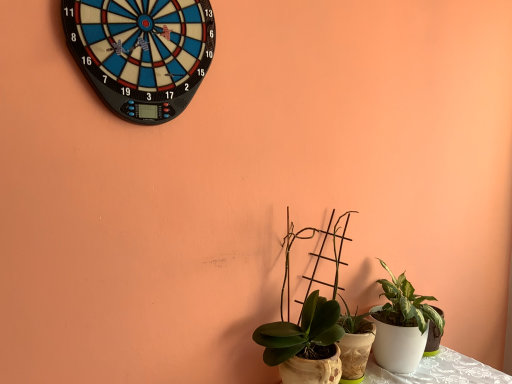
Question: Is green matte plant at center, the 1th houseplant from the left, not within white glossy pot at lower right, which appears as the 1th houseplant when viewed from the right?

Choices:
 (A) yes
 (B) no

Answer: (A)

Question: Is green matte plant at center, the 1th houseplant from the left, shorter than white glossy pot at lower right, which appears as the 1th houseplant when viewed from the right?

Choices:
 (A) no
 (B) yes

Answer: (A)

Question: Considering the relative sizes of green matte plant at center, the 1th houseplant from the left, and white glossy pot at lower right, the 2th houseplant in the left-to-right sequence, in the image provided, is green matte plant at center, the 1th houseplant from the left, bigger than white glossy pot at lower right, the 2th houseplant in the left-to-right sequence,?

Choices:
 (A) no
 (B) yes

Answer: (B)

Question: From a real-world perspective, is green matte plant at center, which is the second houseplant in right-to-left order, positioned over white glossy pot at lower right, which appears as the 1th houseplant when viewed from the right, based on gravity?

Choices:
 (A) no
 (B) yes

Answer: (B)

Question: Is green matte plant at center, which is the second houseplant in right-to-left order, turned away from white glossy pot at lower right, the 2th houseplant in the left-to-right sequence?

Choices:
 (A) no
 (B) yes

Answer: (A)

Question: From the image's perspective, is white glossy pot at lower right, the 2th houseplant in the left-to-right sequence, located above or below green matte plant at center, which is the second houseplant in right-to-left order?

Choices:
 (A) below
 (B) above

Answer: (A)

Question: From a real-world perspective, relative to green matte plant at center, which is the second houseplant in right-to-left order, is white glossy pot at lower right, the 2th houseplant in the left-to-right sequence, vertically above or below?

Choices:
 (A) below
 (B) above

Answer: (A)

Question: Is white glossy pot at lower right, which appears as the 1th houseplant when viewed from the right, spatially inside green matte plant at center, the 1th houseplant from the left, or outside of it?

Choices:
 (A) inside
 (B) outside

Answer: (B)

Question: Is white glossy pot at lower right, the 2th houseplant in the left-to-right sequence, wider or thinner than green matte plant at center, the 1th houseplant from the left?

Choices:
 (A) wide
 (B) thin

Answer: (A)

Question: In the image, is white glossy pot at lower right, which appears as the 1th houseplant when viewed from the right, positioned in front of or behind blue plastic dartboard at upper left?

Choices:
 (A) behind
 (B) front

Answer: (A)

Question: In terms of height, does white glossy pot at lower right, which appears as the 1th houseplant when viewed from the right, look taller or shorter compared to blue plastic dartboard at upper left?

Choices:
 (A) short
 (B) tall

Answer: (B)

Question: From the image's perspective, is white glossy pot at lower right, which appears as the 1th houseplant when viewed from the right, above or below blue plastic dartboard at upper left?

Choices:
 (A) above
 (B) below

Answer: (B)

Question: Is white glossy pot at lower right, which appears as the 1th houseplant when viewed from the right, to the left or to the right of blue plastic dartboard at upper left in the image?

Choices:
 (A) right
 (B) left

Answer: (A)

Question: From the image's perspective, is blue plastic dartboard at upper left located above or below green matte plant at center, which is the second houseplant in right-to-left order?

Choices:
 (A) above
 (B) below

Answer: (A)

Question: Does point (113, 69) appear closer or farther from the camera than point (311, 296)?

Choices:
 (A) closer
 (B) farther

Answer: (A)